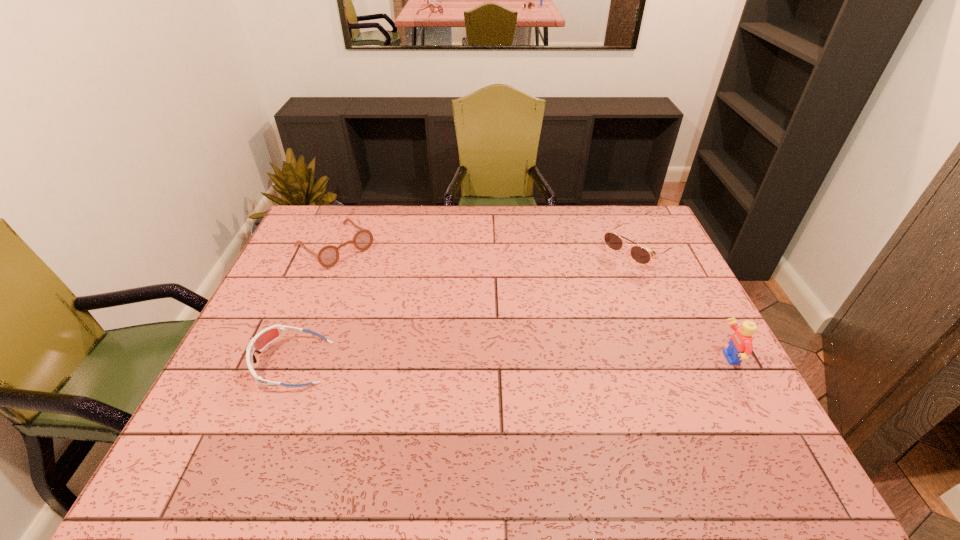
Locate an element on the screen. The width and height of the screenshot is (960, 540). sunglasses that is at the right edge is located at coordinates (639, 254).

Find the location of a particular element. The width and height of the screenshot is (960, 540). object at the far left corner is located at coordinates (327, 256).

Where is `object that is at the far right corner`? The height and width of the screenshot is (540, 960). object that is at the far right corner is located at coordinates (639, 254).

In order to click on free spot at the far edge of the desktop in this screenshot , I will do `click(460, 231)`.

I want to click on free spot at the near edge of the desktop, so click(x=662, y=401).

This screenshot has width=960, height=540. I want to click on free space at the left edge, so click(237, 363).

Locate an element on the screen. The image size is (960, 540). vacant space at the near left corner is located at coordinates (264, 395).

This screenshot has width=960, height=540. In order to click on vacant space at the far right corner in this screenshot , I will do `click(632, 218)`.

Where is `blank region between the spectacles and the goggles`? blank region between the spectacles and the goggles is located at coordinates (313, 305).

Find the location of a particular element. This screenshot has width=960, height=540. free spot between the goggles and the tallest object is located at coordinates (510, 361).